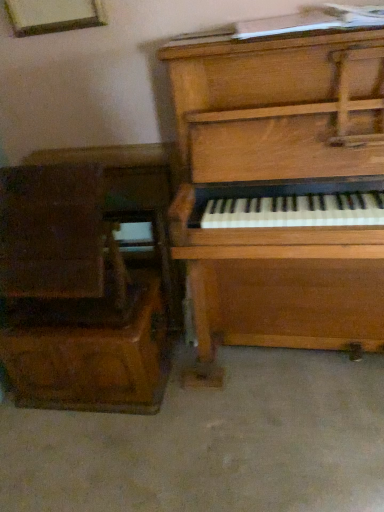
Find the location of a particular element. vacant space in front of wooden drawer at left is located at coordinates (102, 455).